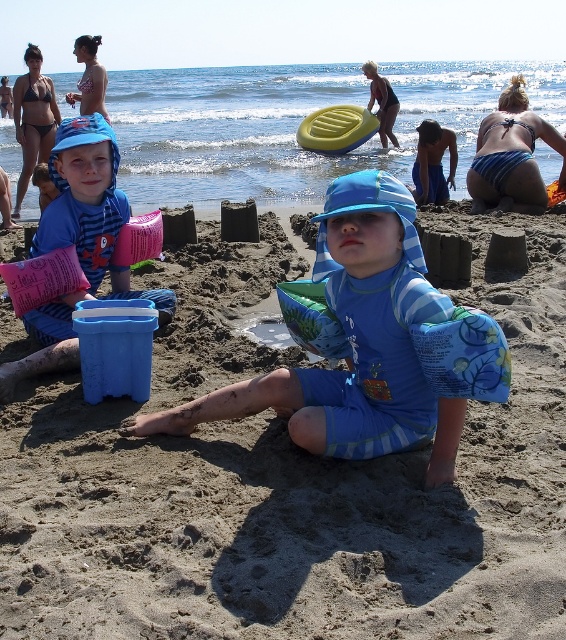
Question: Which of the following is the closest to the observer?

Choices:
 (A) smooth sand at center
 (B) blue fabric swimsuit at center
 (C) matte black bikini at upper left

Answer: (A)

Question: Which object is farther from the camera taking this photo?

Choices:
 (A) blue fabric swimsuit at center
 (B) smooth sand at center
 (C) blue striped bikini at upper right

Answer: (C)

Question: Which point is closer to the camera taking this photo?

Choices:
 (A) (93, 106)
 (B) (117, 192)
 (C) (128, 432)

Answer: (C)

Question: Can you confirm if smooth sand at center is thinner than pink fabric bucket at left?

Choices:
 (A) no
 (B) yes

Answer: (A)

Question: Does blue fabric swimsuit at center have a larger size compared to pink fabric bucket at left?

Choices:
 (A) no
 (B) yes

Answer: (A)

Question: Is blue striped bikini at upper right in front of dark blue swimsuit at upper center?

Choices:
 (A) no
 (B) yes

Answer: (B)